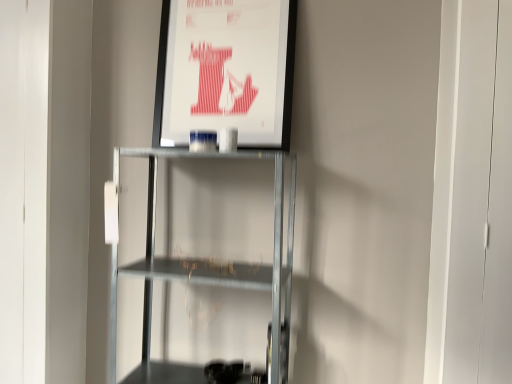
Question: Considering the relative positions of matte paper poster at upper center and metallic gray shelf at center in the image provided, is matte paper poster at upper center to the left or to the right of metallic gray shelf at center?

Choices:
 (A) right
 (B) left

Answer: (A)

Question: Is point (194, 127) positioned closer to the camera than point (145, 254)?

Choices:
 (A) farther
 (B) closer

Answer: (B)

Question: Considering the positions of matte paper poster at upper center and metallic gray shelf at center in the image, is matte paper poster at upper center wider or thinner than metallic gray shelf at center?

Choices:
 (A) wide
 (B) thin

Answer: (B)

Question: From the image's perspective, is metallic gray shelf at center located above or below matte paper poster at upper center?

Choices:
 (A) above
 (B) below

Answer: (B)

Question: From a real-world perspective, relative to matte paper poster at upper center, is metallic gray shelf at center vertically above or below?

Choices:
 (A) above
 (B) below

Answer: (B)

Question: In terms of width, does metallic gray shelf at center look wider or thinner when compared to matte paper poster at upper center?

Choices:
 (A) wide
 (B) thin

Answer: (A)

Question: Is point (291, 231) positioned closer to the camera than point (194, 0)?

Choices:
 (A) closer
 (B) farther

Answer: (A)